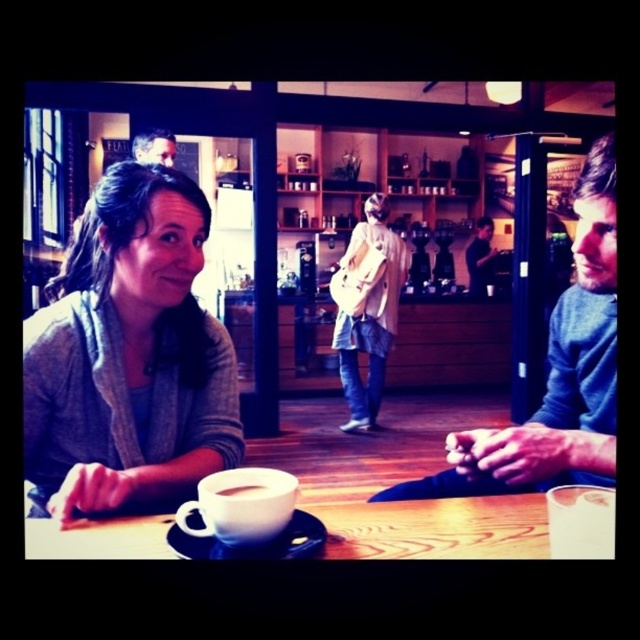
You are a customer in the cafe and want to grab the white matte mug at center without disturbing the dark blue sweater at right. Is it possible to reach the mug from your current position?

The white matte mug at center is behind the dark blue sweater at right, so you can reach it without moving the dark blue sweater at right by reaching around or behind it.